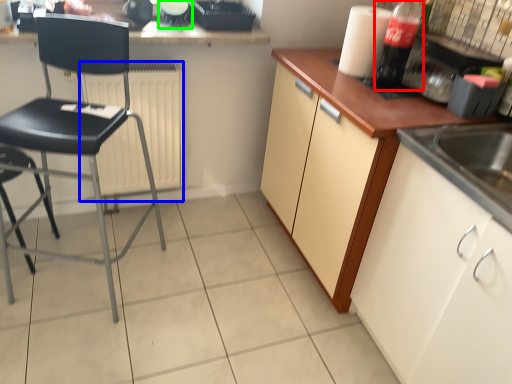
Question: Based on their relative distances, which object is farther from bottle (highlighted by a red box)? Choose from radiator (highlighted by a blue box) and appliance (highlighted by a green box).

Choices:
 (A) radiator
 (B) appliance

Answer: (A)